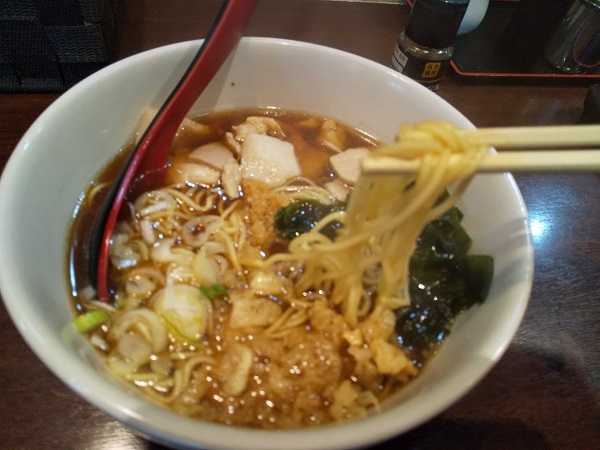
Locate an element on the screen. table is located at coordinates (45, 407), (528, 396), (578, 197), (522, 108), (341, 19), (63, 37).